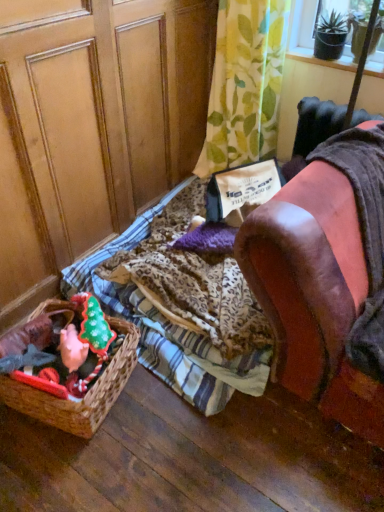
Question: From the image's perspective, relative to brown woven basket at lower left, is leather armchair at right above or below?

Choices:
 (A) below
 (B) above

Answer: (B)

Question: Is leather armchair at right spatially inside brown woven basket at lower left, or outside of it?

Choices:
 (A) outside
 (B) inside

Answer: (A)

Question: Considering the real-world distances, which object is closest to the leather armchair at right?

Choices:
 (A) transparent plastic screen at upper right
 (B) wooden screen door at left
 (C) brown woven basket at lower left
 (D) green leafy fabric at upper center
 (E) leopard print fabric at center

Answer: (E)

Question: Which object is positioned closest to the leather armchair at right?

Choices:
 (A) transparent plastic screen at upper right
 (B) brown woven basket at lower left
 (C) green leafy fabric at upper center
 (D) leopard print fabric at center
 (E) wooden screen door at left

Answer: (D)